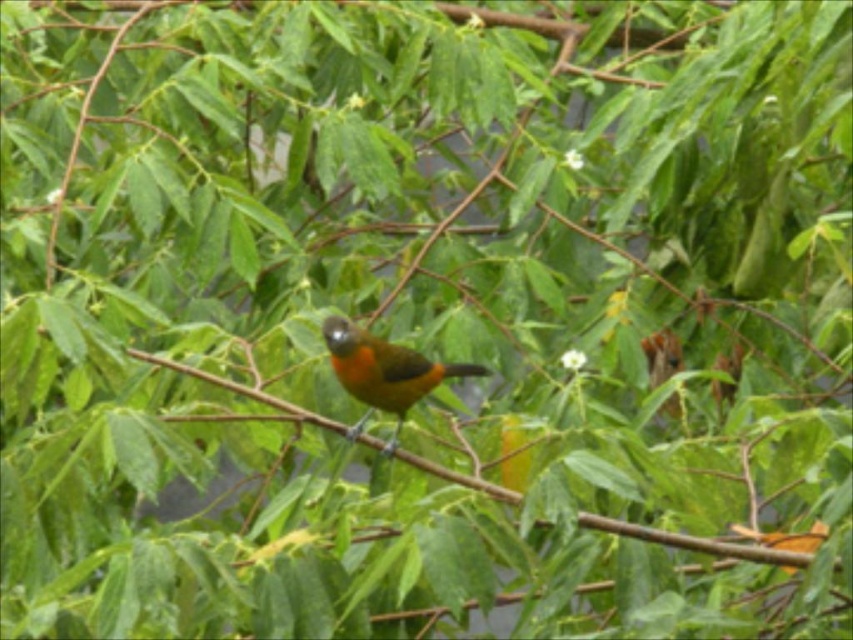
Which is below, green matte branch at center or orange matte bird at center?

green matte branch at center is below.

Who is more forward, [177,368] or [370,365]?

Point [370,365]

I want to click on green matte branch at center, so click(695, 541).